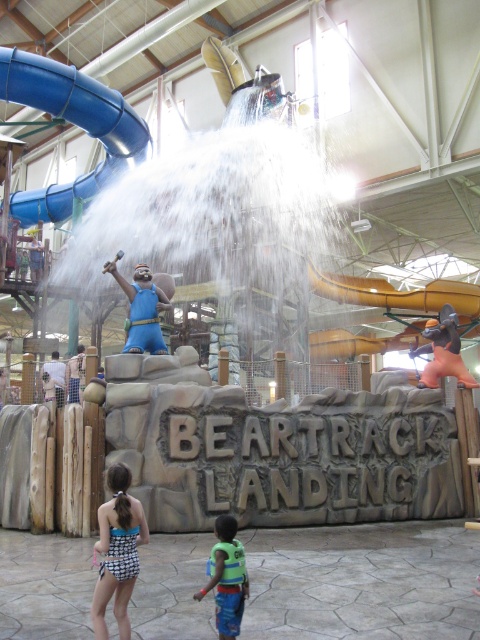
Question: Among these points, which one is farthest from the camera?

Choices:
 (A) (144, 518)
 (B) (40, 275)
 (C) (108, 177)
 (D) (169, 301)

Answer: (C)

Question: Which point appears farthest from the camera in this image?

Choices:
 (A) (29, 262)
 (B) (68, 364)
 (C) (137, 296)

Answer: (A)

Question: Which object is positioned closest to the green life vest at lower center?

Choices:
 (A) blue fabric shorts at center
 (B) blue rubber slide at upper left
 (C) blue fabric statue at center

Answer: (C)

Question: Does blue fabric statue at center lie behind blue rubber duck at upper center?

Choices:
 (A) yes
 (B) no

Answer: (B)

Question: Does blue fabric statue at center appear on the right side of blue fabric shorts at center?

Choices:
 (A) yes
 (B) no

Answer: (A)

Question: Is blue and white checkered swimsuit at lower left positioned at the back of light blue fabric shorts at center?

Choices:
 (A) no
 (B) yes

Answer: (A)